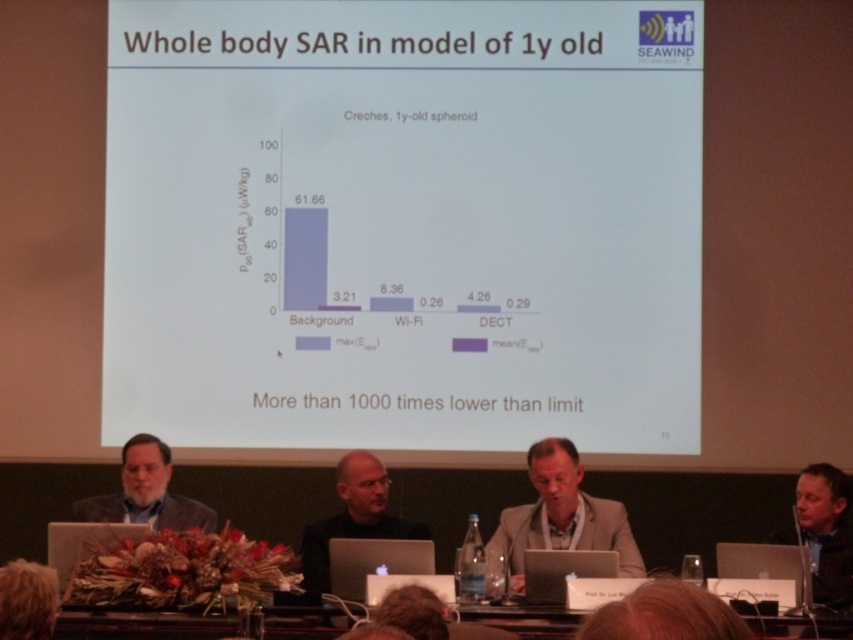
Is white matte projector screen at upper center to the right of black plastic laptop at lower right from the viewer's perspective?

No, white matte projector screen at upper center is not to the right of black plastic laptop at lower right.

Is white matte projector screen at upper center smaller than black plastic laptop at lower right?

No.

Where is `white matte projector screen at upper center`? This screenshot has height=640, width=853. white matte projector screen at upper center is located at coordinates (403, 224).

Who is positioned more to the left, matte silver laptop at center or black plastic laptop at lower right?

matte silver laptop at center is more to the left.

Who is positioned more to the right, matte silver laptop at center or black plastic laptop at lower right?

black plastic laptop at lower right is more to the right.

What do you see at coordinates (84, 544) in the screenshot?
I see `matte silver laptop at center` at bounding box center [84, 544].

At what (x,y) coordinates should I click in order to perform the action: click on matte silver laptop at center. Please return your answer as a coordinate pair (x, y). The image size is (853, 640). Looking at the image, I should click on (84, 544).

Does blonde hair at upper center appear under black plastic laptop at lower right?

Actually, blonde hair at upper center is above black plastic laptop at lower right.

Can you confirm if blonde hair at upper center is positioned above black plastic laptop at lower right?

Yes.

Between point (697, 589) and point (730, 563), which one is positioned behind?

Point (730, 563)

This screenshot has width=853, height=640. Identify the location of blonde hair at upper center. (664, 614).